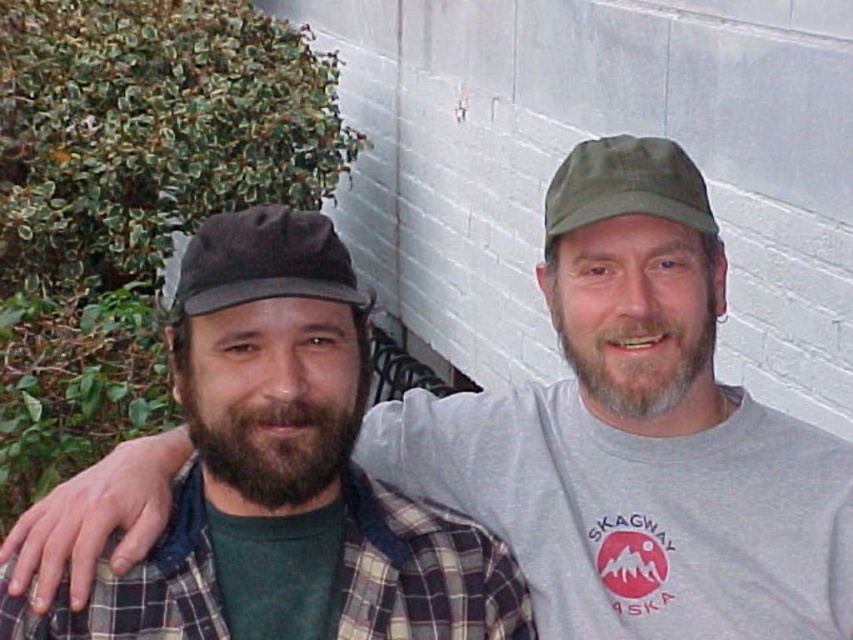
Measure the distance from dark brown fabric baseball cap at center to green fabric cap at upper center.

The distance of dark brown fabric baseball cap at center from green fabric cap at upper center is 14.91 inches.

Describe the element at coordinates (264, 260) in the screenshot. I see `dark brown fabric baseball cap at center` at that location.

Between point (193, 285) and point (556, 198), which one is positioned in front?

Point (193, 285)

Where is `dark brown fabric baseball cap at center`? This screenshot has width=853, height=640. dark brown fabric baseball cap at center is located at coordinates (264, 260).